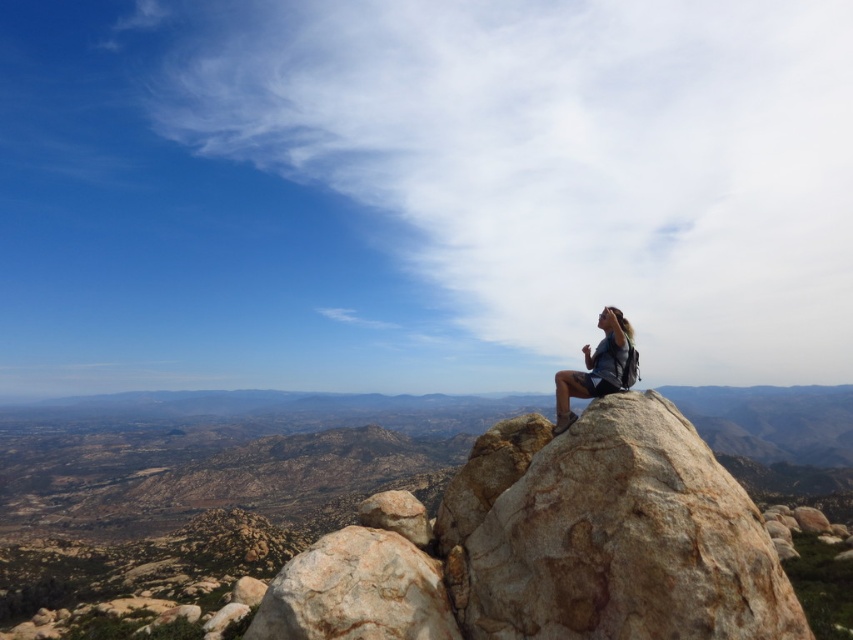
Does brown rough rock at center appear over rough textured rock at center?

Indeed, brown rough rock at center is positioned over rough textured rock at center.

Who is more forward, (631, 504) or (287, 570)?

Point (631, 504) is in front.

This screenshot has height=640, width=853. In order to click on brown rough rock at center in this screenshot , I will do `click(625, 540)`.

Identify the location of brown rough rock at center. The height and width of the screenshot is (640, 853). (625, 540).

Consider the image. Is brown rough rock at upper center below brown rough rock at center?

Yes, brown rough rock at upper center is below brown rough rock at center.

Does point (294, 403) come farther from viewer compared to point (503, 632)?

Yes, it is.

At what (x,y) coordinates should I click in order to perform the action: click on brown rough rock at upper center. Please return your answer as a coordinate pair (x, y). The width and height of the screenshot is (853, 640). Looking at the image, I should click on (210, 474).

Consider the image. Is rough textured rock at center below dark gray backpack at center?

Indeed, rough textured rock at center is positioned under dark gray backpack at center.

Does rough textured rock at center have a lesser width compared to dark gray backpack at center?

Yes.

Image resolution: width=853 pixels, height=640 pixels. I want to click on rough textured rock at center, so click(x=357, y=592).

Locate an element on the screen. rough textured rock at center is located at coordinates (357, 592).